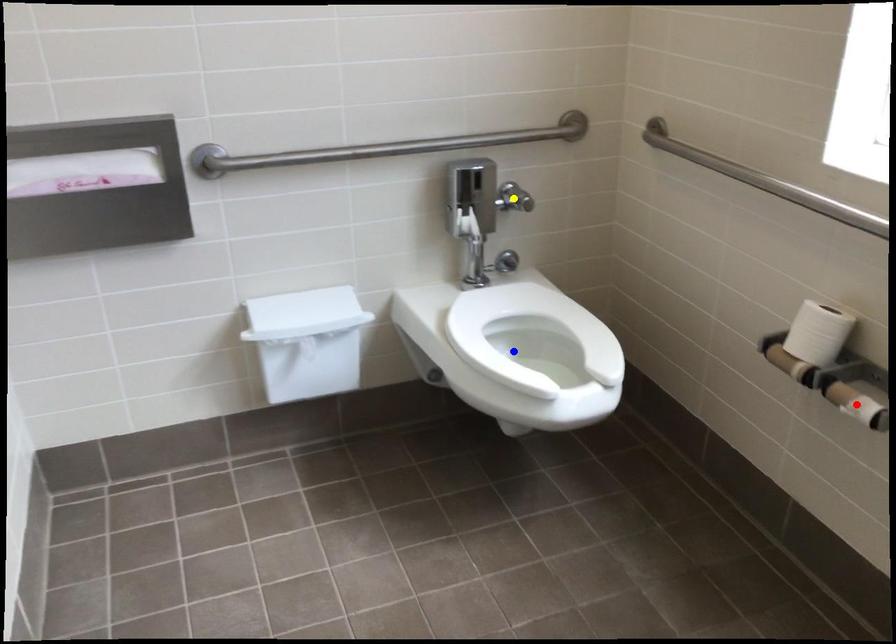
Order these from nearest to farthest:
1. red point
2. blue point
3. yellow point

red point → blue point → yellow point